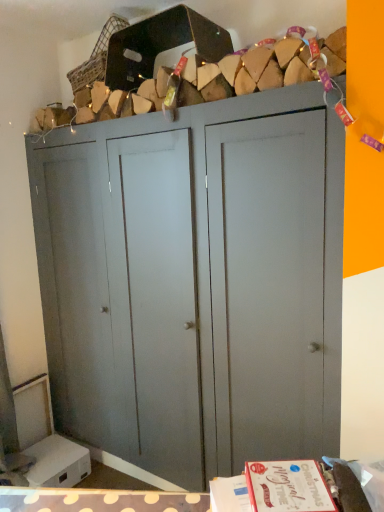
Measure the distance between woven fabric basket at upper center and camera.

The depth of woven fabric basket at upper center is 6.76 feet.

What do you see at coordinates (96, 57) in the screenshot? I see `woven fabric basket at upper center` at bounding box center [96, 57].

You are a GUI agent. You are given a task and a screenshot of the screen. Output one action in this format:
    pyautogui.click(x=<x>, y=<y>)
    Task: Click on the woven fabric basket at upper center
    The height and width of the screenshot is (512, 384).
    Given the screenshot: What is the action you would take?
    pyautogui.click(x=96, y=57)

Find the location of `matte gray cupboard at center`. matte gray cupboard at center is located at coordinates (195, 282).

What do you see at coordinates (195, 282) in the screenshot? Image resolution: width=384 pixels, height=512 pixels. I see `matte gray cupboard at center` at bounding box center [195, 282].

I want to click on woven fabric basket at upper center, so click(96, 57).

From the picture: Based on their positions, is matte gray cupboard at center located to the left or right of woven fabric basket at upper center?

matte gray cupboard at center is to the right of woven fabric basket at upper center.

Which is behind, matte gray cupboard at center or woven fabric basket at upper center?

woven fabric basket at upper center.

Is point (244, 442) closer or farther from the camera than point (85, 77)?

Point (244, 442) is closer to the camera than point (85, 77).

From the image's perspective, is matte gray cupboard at center located beneath woven fabric basket at upper center?

Yes.

From a real-world perspective, who is located lower, matte gray cupboard at center or woven fabric basket at upper center?

matte gray cupboard at center, from a real-world perspective.

Looking at their sizes, would you say matte gray cupboard at center is wider or thinner than woven fabric basket at upper center?

In the image, matte gray cupboard at center appears to be wider than woven fabric basket at upper center.

Considering the relative sizes of matte gray cupboard at center and woven fabric basket at upper center in the image provided, is matte gray cupboard at center shorter than woven fabric basket at upper center?

Incorrect, the height of matte gray cupboard at center does not fall short of that of woven fabric basket at upper center.

Is matte gray cupboard at center smaller than woven fabric basket at upper center?

Incorrect, matte gray cupboard at center is not smaller in size than woven fabric basket at upper center.

Could woven fabric basket at upper center be considered to be inside matte gray cupboard at center?

No, woven fabric basket at upper center is not a part of matte gray cupboard at center.

Is there a large distance between matte gray cupboard at center and woven fabric basket at upper center?

Yes, matte gray cupboard at center and woven fabric basket at upper center are quite far apart.

Could you tell me if matte gray cupboard at center is turned towards woven fabric basket at upper center?

No, matte gray cupboard at center is not oriented towards woven fabric basket at upper center.

How different are the orientations of matte gray cupboard at center and woven fabric basket at upper center in degrees?

2.1 degrees.

How far apart are matte gray cupboard at center and woven fabric basket at upper center?

matte gray cupboard at center is 1.01 meters away from woven fabric basket at upper center.

Find the location of a particular element. cupboard in front of the woven fabric basket at upper center is located at coordinates (195, 282).

Between woven fabric basket at upper center and matte gray cupboard at center, which one appears on the right side from the viewer's perspective?

Positioned to the right is matte gray cupboard at center.

Which is in front, woven fabric basket at upper center or matte gray cupboard at center?

matte gray cupboard at center is in front.

From the picture: Which point is more distant from viewer, (86,70) or (313,452)?

The point (86,70) is behind.

From the image's perspective, is woven fabric basket at upper center under matte gray cupboard at center?

No.

Looking at this image, from a real-world perspective, is woven fabric basket at upper center above or below matte gray cupboard at center?

From a real-world perspective, woven fabric basket at upper center is physically above matte gray cupboard at center.

Consider the image. Can you confirm if woven fabric basket at upper center is thinner than matte gray cupboard at center?

Yes.

Considering the sizes of objects woven fabric basket at upper center and matte gray cupboard at center in the image provided, who is taller, woven fabric basket at upper center or matte gray cupboard at center?

matte gray cupboard at center.

Considering the sizes of objects woven fabric basket at upper center and matte gray cupboard at center in the image provided, who is bigger, woven fabric basket at upper center or matte gray cupboard at center?

matte gray cupboard at center is bigger.

In the scene shown: Could matte gray cupboard at center be considered to be inside woven fabric basket at upper center?

No, woven fabric basket at upper center does not contain matte gray cupboard at center.

Would you consider woven fabric basket at upper center to be distant from matte gray cupboard at center?

Yes, woven fabric basket at upper center is far from matte gray cupboard at center.

Is woven fabric basket at upper center facing towards matte gray cupboard at center?

No, woven fabric basket at upper center is not turned towards matte gray cupboard at center.

Based on the photo, how many degrees apart are the facing directions of woven fabric basket at upper center and matte gray cupboard at center?

2.1 degrees.

Measure the distance from woven fabric basket at upper center to matte gray cupboard at center.

woven fabric basket at upper center is 3.32 feet away from matte gray cupboard at center.

Where is `cupboard lying below the woven fabric basket at upper center (from the image's perspective)`? This screenshot has width=384, height=512. cupboard lying below the woven fabric basket at upper center (from the image's perspective) is located at coordinates point(195,282).

Locate an element on the screen. The width and height of the screenshot is (384, 512). basket located above the matte gray cupboard at center (from the image's perspective) is located at coordinates (96, 57).

Find the location of a particular element. basket to the left of matte gray cupboard at center is located at coordinates (96, 57).